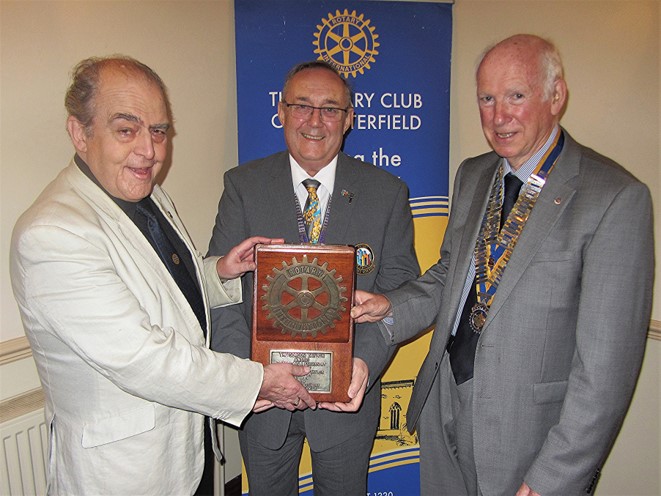
This screenshot has width=661, height=496. Identify the location of wall. tap(207, 99).